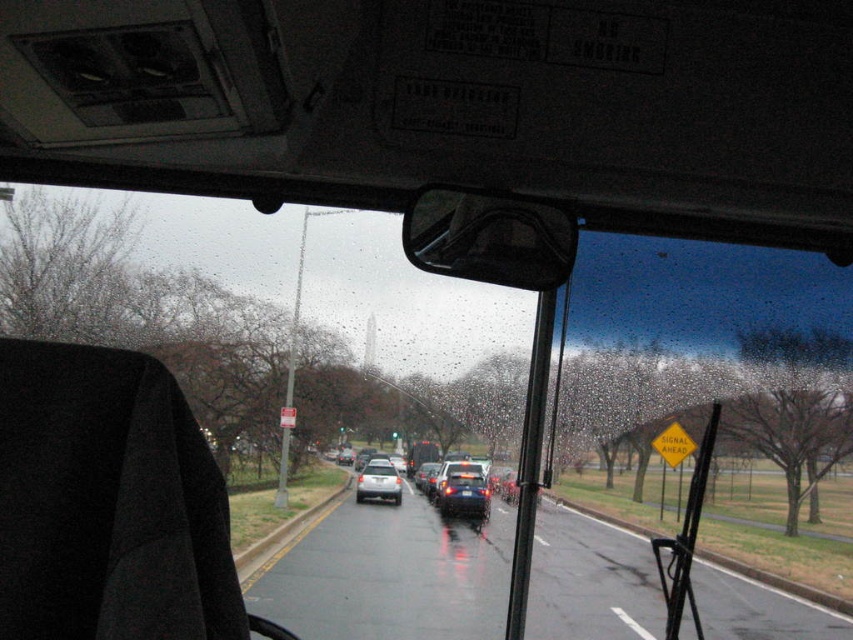
Does matte black sedan at center appear on the right side of black plastic license plate at center?

In fact, matte black sedan at center is to the left of black plastic license plate at center.

How far apart are matte black sedan at center and black plastic license plate at center?

Result: 59.37 centimeters

Does point (439, 492) lie behind point (466, 490)?

No, it is in front of (466, 490).

Locate an element on the screen. The image size is (853, 640). matte black sedan at center is located at coordinates (459, 488).

Is the position of satin silver sedan at center less distant than that of black plastic license plate at center?

Yes, it is.

Does point (358, 477) come behind point (465, 492)?

That is False.

Is point (361, 497) positioned after point (471, 490)?

That is False.

You are a GUI agent. You are given a task and a screenshot of the screen. Output one action in this format:
    pyautogui.click(x=<x>, y=<y>)
    Task: Click on the satin silver sedan at center
    
    Given the screenshot: What is the action you would take?
    pyautogui.click(x=378, y=481)

Between matte black sedan at center and metallic silver bus at center, which one has less height?

metallic silver bus at center

What do you see at coordinates (459, 488) in the screenshot? The width and height of the screenshot is (853, 640). I see `matte black sedan at center` at bounding box center [459, 488].

Image resolution: width=853 pixels, height=640 pixels. In order to click on matte black sedan at center in this screenshot , I will do `click(459, 488)`.